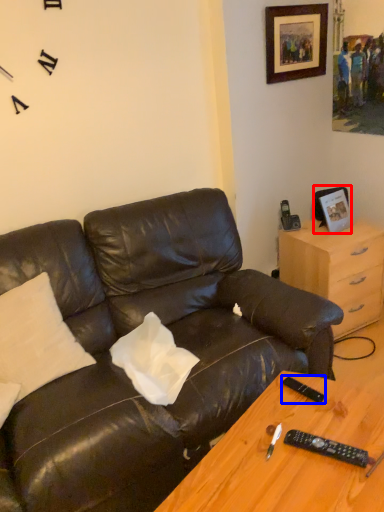
Question: Which point is closer to the camera, picture frame (highlighted by a red box) or remote (highlighted by a blue box)?

Choices:
 (A) picture frame
 (B) remote

Answer: (B)